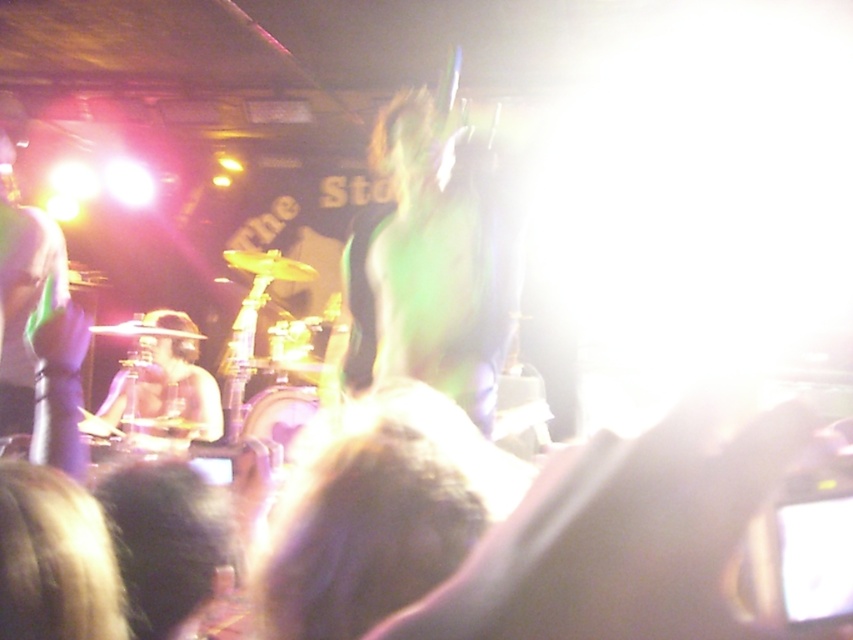
You are a photographer at the concert. You want to capture a photo that includes both the green matte hand at center and the shiny purple shirt at left. Which object should you adjust your camera to focus on first to ensure both are in the frame?

The green matte hand at center is taller than the shiny purple shirt at left. To ensure both are in the frame, focus on the taller object first, which is the green matte hand at center.

You are at the concert and want to take a photo of the drummer. There are two points marked in the image. Point A is at coordinates point (461, 307) and Point B is at coordinates point (172, 396). Which point is closer to the camera and would give a better closeup shot of the drummer?

Point A at coordinates point (461, 307) is closer to the camera than point B at coordinates point (172, 396), so it would provide a better closeup shot of the drummer.